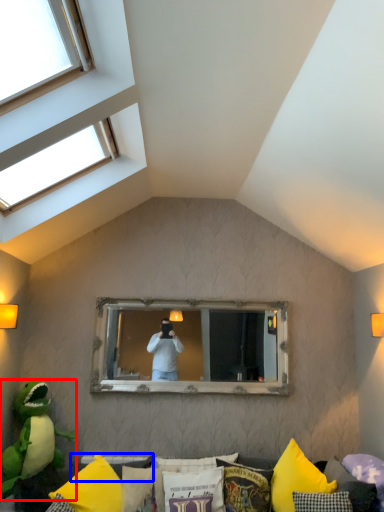
Question: Which object appears closest to the camera in this image, parrot (highlighted by a red box) or pillow (highlighted by a blue box)?

Choices:
 (A) parrot
 (B) pillow

Answer: (A)